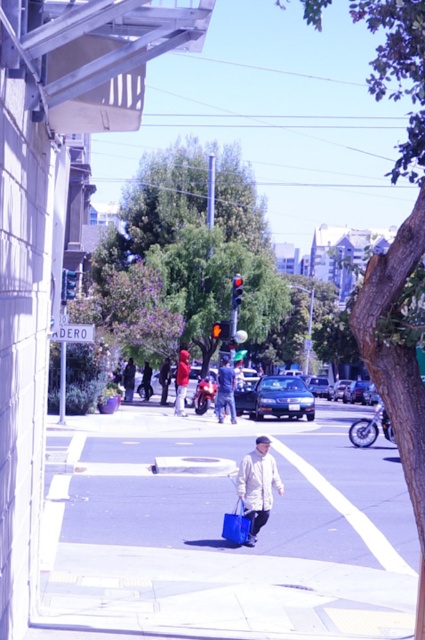
Question: Considering the relative positions of denim jacket at center and red fabric jacket at center in the image provided, where is denim jacket at center located with respect to red fabric jacket at center?

Choices:
 (A) left
 (B) right

Answer: (B)

Question: Based on their relative distances, which object is farther from the denim jacket at center?

Choices:
 (A) smooth concrete sidewalk at center
 (B) red fabric jacket at center
 (C) dark blue jeans at center

Answer: (C)

Question: From the image, what is the correct spatial relationship of smooth concrete sidewalk at center in relation to red fabric jacket at center?

Choices:
 (A) above
 (B) below

Answer: (B)

Question: Estimate the real-world distances between objects in this image. Which object is closer to the dark blue jeans at center?

Choices:
 (A) white matte coat at center
 (B) smooth concrete sidewalk at center
 (C) red fabric jacket at center

Answer: (C)

Question: Is the position of shiny blue sedan at center less distant than that of red fabric jacket at center?

Choices:
 (A) no
 (B) yes

Answer: (A)

Question: Which is farther from the white matte coat at center?

Choices:
 (A) smooth concrete sidewalk at center
 (B) denim jacket at center
 (C) dark blue jeans at center

Answer: (C)